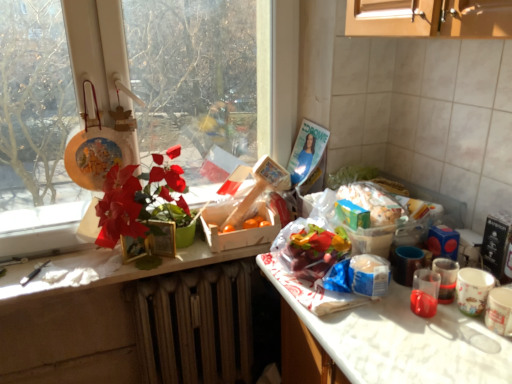
Where is `empty space that is ontop of translucent plastic container at center (from a real-world perspective)`? Image resolution: width=512 pixels, height=384 pixels. empty space that is ontop of translucent plastic container at center (from a real-world perspective) is located at coordinates (367, 189).